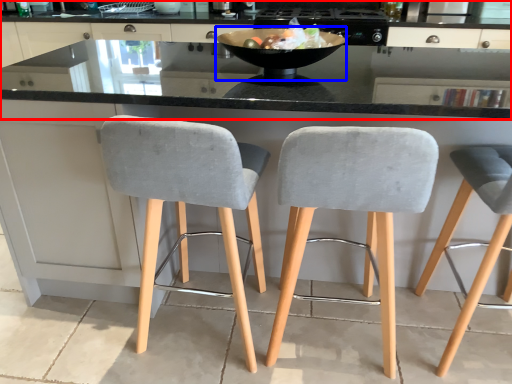
Question: Which point is further to the camera, cabinetry (highlighted by a red box) or bowl (highlighted by a blue box)?

Choices:
 (A) cabinetry
 (B) bowl

Answer: (A)